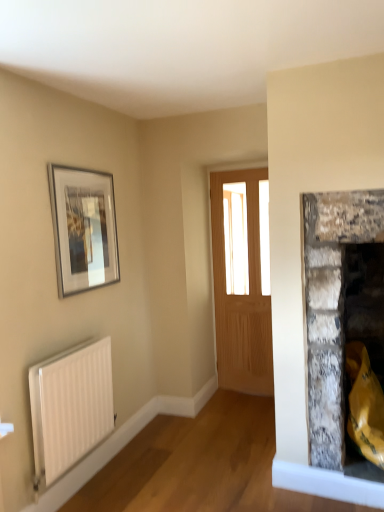
Question: Choose the correct answer: Is white matte radiator at lower left inside light brown wooden door at center or outside it?

Choices:
 (A) outside
 (B) inside

Answer: (A)

Question: Looking at their shapes, would you say white matte radiator at lower left is wider or thinner than light brown wooden door at center?

Choices:
 (A) wide
 (B) thin

Answer: (B)

Question: Based on their relative distances, which object is nearer to the silver metallic picture frame at upper left?

Choices:
 (A) white matte radiator at lower left
 (B) light brown wooden door at center

Answer: (A)

Question: Which of these objects is positioned farthest from the light brown wooden door at center?

Choices:
 (A) silver metallic picture frame at upper left
 (B) white matte radiator at lower left

Answer: (B)